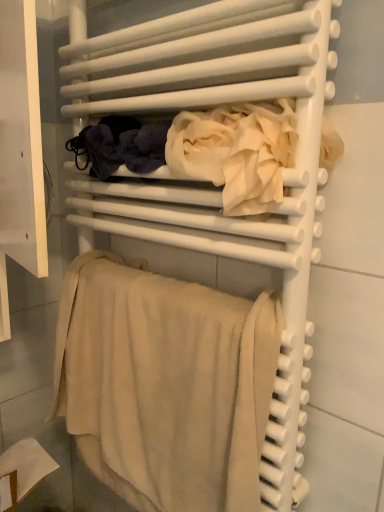
Question: From a real-world perspective, is white cotton towel at center beneath beige textured towel at lower center?

Choices:
 (A) no
 (B) yes

Answer: (A)

Question: Considering the relative sizes of white cotton towel at center and beige textured towel at lower center in the image provided, is white cotton towel at center wider than beige textured towel at lower center?

Choices:
 (A) no
 (B) yes

Answer: (B)

Question: Considering the relative sizes of white cotton towel at center and beige textured towel at lower center in the image provided, is white cotton towel at center thinner than beige textured towel at lower center?

Choices:
 (A) yes
 (B) no

Answer: (B)

Question: Considering the relative positions of white cotton towel at center and beige textured towel at lower center in the image provided, is white cotton towel at center to the right of beige textured towel at lower center from the viewer's perspective?

Choices:
 (A) yes
 (B) no

Answer: (A)

Question: Is white cotton towel at center positioned in front of beige textured towel at lower center?

Choices:
 (A) yes
 (B) no

Answer: (A)

Question: Can beige textured towel at lower center be found inside white cotton towel at center?

Choices:
 (A) yes
 (B) no

Answer: (B)

Question: Would you consider beige textured towel at lower center to be distant from white cotton towel at center?

Choices:
 (A) no
 (B) yes

Answer: (A)

Question: Is white cotton towel at center at the back of beige textured towel at lower center?

Choices:
 (A) no
 (B) yes

Answer: (A)

Question: Is white cotton towel at center located within beige textured towel at lower center?

Choices:
 (A) yes
 (B) no

Answer: (B)

Question: Does beige textured towel at lower center lie behind white cotton towel at center?

Choices:
 (A) yes
 (B) no

Answer: (A)

Question: Is beige textured towel at lower center completely or partially outside of white cotton towel at center?

Choices:
 (A) no
 (B) yes

Answer: (B)

Question: Is beige textured towel at lower center at the right side of white cotton towel at center?

Choices:
 (A) no
 (B) yes

Answer: (A)

Question: In terms of height, does white cotton towel at center look taller or shorter compared to beige textured towel at lower center?

Choices:
 (A) short
 (B) tall

Answer: (A)